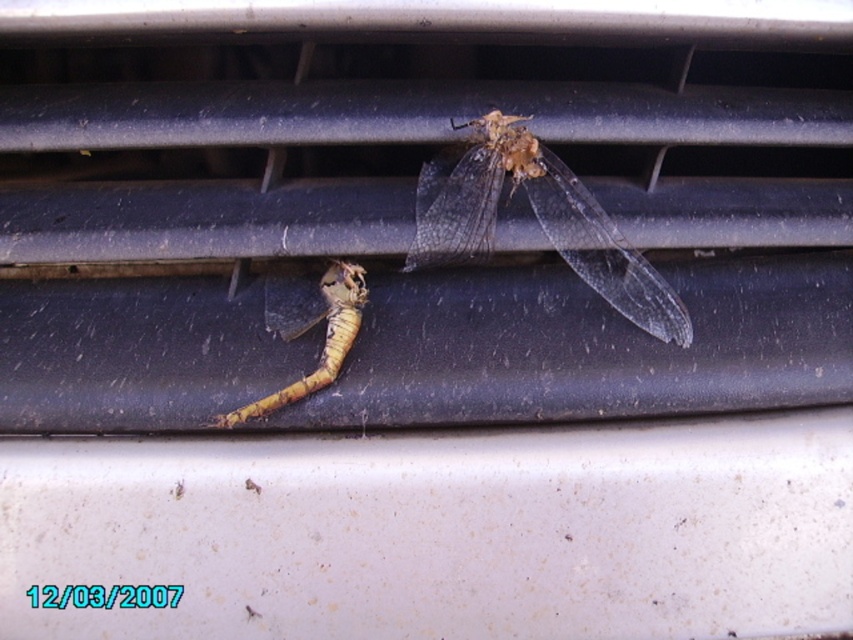
Does translucent winged insect at upper center have a greater width compared to yellowish-brown exoskeleton at center?

Answer: Indeed, translucent winged insect at upper center has a greater width compared to yellowish-brown exoskeleton at center.

Between translucent winged insect at upper center and yellowish-brown exoskeleton at center, which one appears on the right side from the viewer's perspective?

Positioned to the right is translucent winged insect at upper center.

Image resolution: width=853 pixels, height=640 pixels. What do you see at coordinates (537, 220) in the screenshot? I see `translucent winged insect at upper center` at bounding box center [537, 220].

At what (x,y) coordinates should I click in order to perform the action: click on translucent winged insect at upper center. Please return your answer as a coordinate pair (x, y). Looking at the image, I should click on (537, 220).